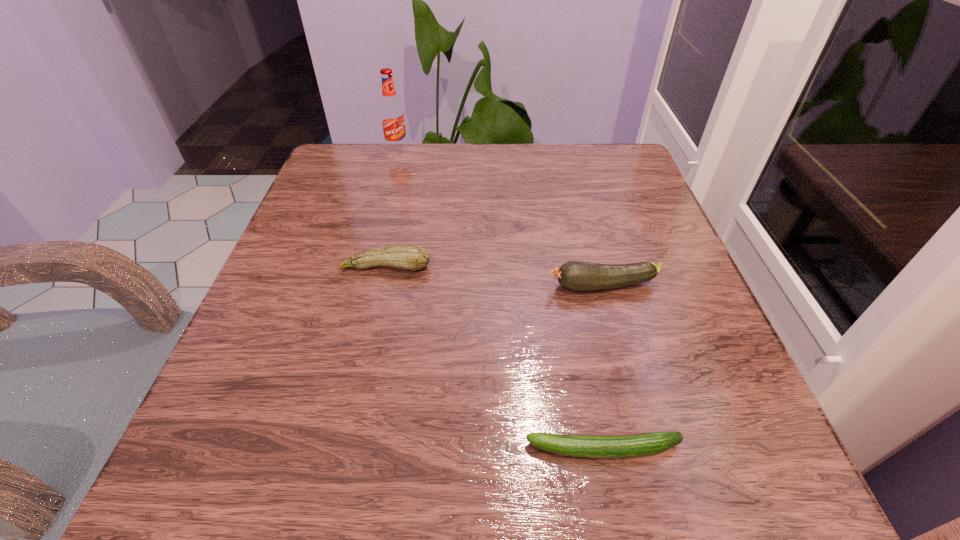
You are a GUI agent. You are given a task and a screenshot of the screen. Output one action in this format:
    pyautogui.click(x=<x>, y=<y>)
    Task: Click on the object that is at the far edge
    This screenshot has width=960, height=540.
    Given the screenshot: What is the action you would take?
    pyautogui.click(x=392, y=115)

The image size is (960, 540). Identify the location of object located in the near edge section of the desktop. (638, 445).

The image size is (960, 540). I want to click on root beer positioned at the left edge, so click(x=392, y=115).

Where is `zucchini located at the left edge`? zucchini located at the left edge is located at coordinates (408, 257).

I want to click on object present at the far left corner, so click(x=392, y=115).

Locate an element on the screen. object at the near right corner is located at coordinates (638, 445).

This screenshot has width=960, height=540. I want to click on free space at the far edge, so click(469, 183).

This screenshot has width=960, height=540. In order to click on vacant area at the near edge in this screenshot , I will do `click(356, 439)`.

The height and width of the screenshot is (540, 960). I want to click on vacant space at the left edge of the desktop, so click(x=327, y=267).

In the image, there is a desktop. Identify the location of vacant space at the right edge. The height and width of the screenshot is (540, 960). (689, 297).